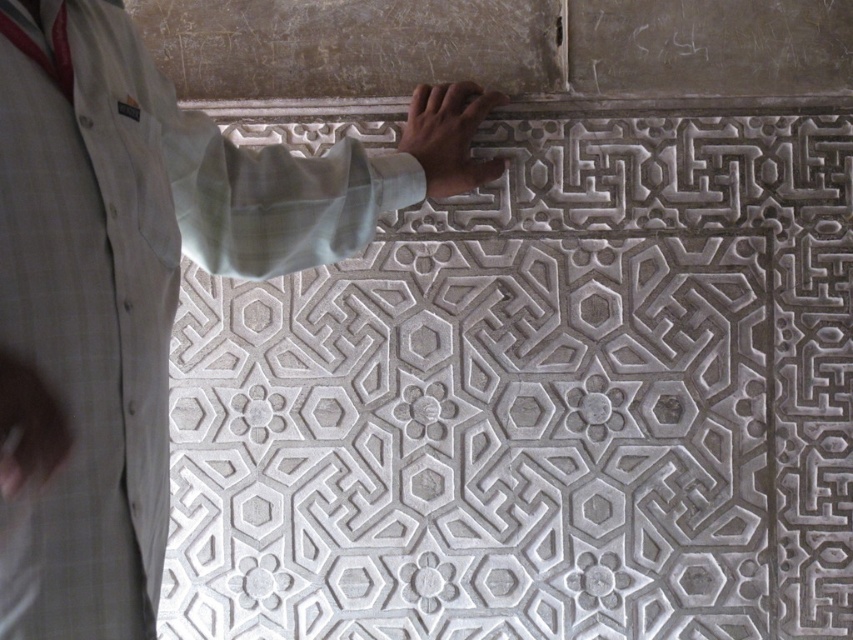
Question: Considering the relative positions of carved stone pattern at center and matte gray hand at upper center in the image provided, where is carved stone pattern at center located with respect to matte gray hand at upper center?

Choices:
 (A) right
 (B) left

Answer: (A)

Question: Which point is closer to the camera?

Choices:
 (A) (416, 99)
 (B) (54, 422)
 (C) (76, 200)

Answer: (B)

Question: Which of the following is the closest to the observer?

Choices:
 (A) white fabric shirt at upper left
 (B) matte gray hand at upper center
 (C) carved stone pattern at center

Answer: (B)

Question: Does light skin hand at center lie in front of matte gray hand at upper center?

Choices:
 (A) yes
 (B) no

Answer: (B)

Question: Which object is closer to the camera taking this photo?

Choices:
 (A) matte gray hand at upper center
 (B) light skin hand at center
 (C) white fabric shirt at upper left
 (D) carved stone pattern at center

Answer: (A)

Question: Can you confirm if white fabric shirt at upper left is smaller than light skin hand at center?

Choices:
 (A) no
 (B) yes

Answer: (A)